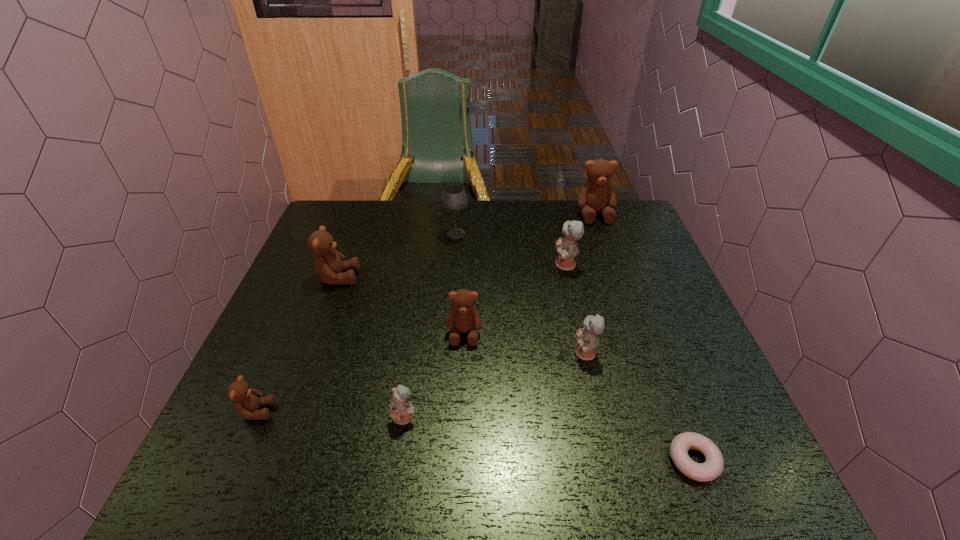
Choose which teddy bear is the fourth nearest neighbor to the leftmost blue teddy bear. Please provide its 2D coordinates. Your answer should be formatted as a tuple, i.e. [(x, y)], where the tuple contains the x and y coordinates of a point satisfying the conditions above.

[(329, 264)]

Choose which teddy bear is the fifth nearest neighbor to the second farthest brown teddy bear. Please provide its 2D coordinates. Your answer should be formatted as a tuple, i.e. [(x, y)], where the tuple contains the x and y coordinates of a point satisfying the conditions above.

[(587, 337)]

Point out which brown teddy bear is positioned as the fourth nearest to the second smallest blue teddy bear. Please provide its 2D coordinates. Your answer should be formatted as a tuple, i.e. [(x, y)], where the tuple contains the x and y coordinates of a point satisfying the conditions above.

[(247, 401)]

Identify which brown teddy bear is the fourth nearest to the smallest blue teddy bear. Please provide its 2D coordinates. Your answer should be formatted as a tuple, i.e. [(x, y)], where the tuple contains the x and y coordinates of a point satisfying the conditions above.

[(597, 194)]

Point out which blue teddy bear is positioned as the nearest to the seventh object from right to left. Please provide its 2D coordinates. Your answer should be formatted as a tuple, i.e. [(x, y)], where the tuple contains the x and y coordinates of a point satisfying the conditions above.

[(587, 337)]

Locate an element on the screen. This screenshot has height=540, width=960. blue teddy bear that is the second nearest to the farthest object is located at coordinates [x=587, y=337].

This screenshot has width=960, height=540. Identify the location of vacant space that satisfies the following two spatial constraints: 1. on the front-facing side of the second farthest blue teddy bear; 2. on the front-facing side of the third teddy bear from left to right. (600, 417).

Identify the location of blank area in the image that satisfies the following two spatial constraints: 1. on the front-facing side of the farthest blue teddy bear; 2. on the right side of the doughnut. The image size is (960, 540). (611, 461).